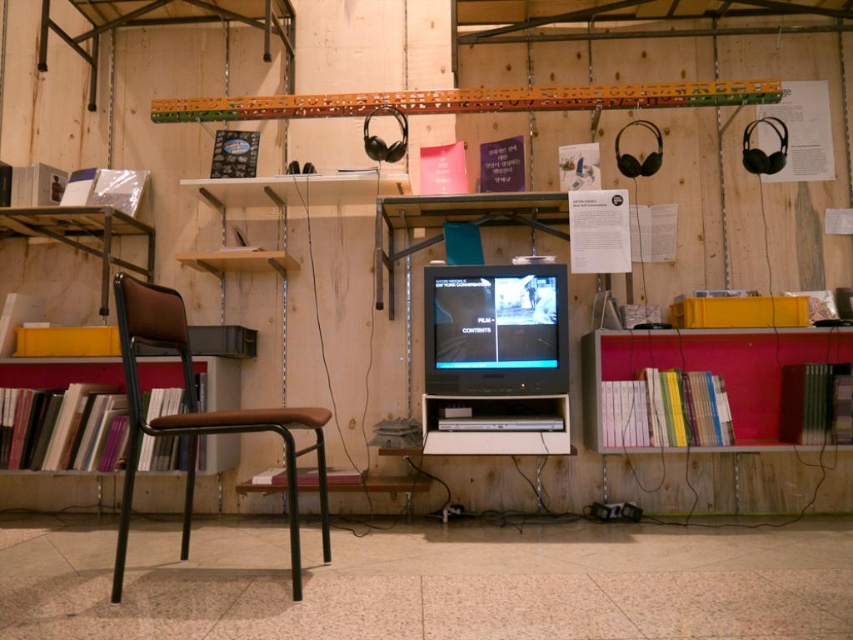
Question: Among these objects, which one is nearest to the camera?

Choices:
 (A) wooden bookshelf at left
 (B) matte black monitor at center
 (C) hardcover books at right

Answer: (C)

Question: Which of the following is the farthest from the observer?

Choices:
 (A) (155, 317)
 (B) (78, 378)

Answer: (B)

Question: Can you confirm if hardcover books at right is positioned to the left of brown leather chair at left?

Choices:
 (A) no
 (B) yes

Answer: (A)

Question: Does hardcover books at right have a larger size compared to brown leather chair at left?

Choices:
 (A) yes
 (B) no

Answer: (B)

Question: Which object appears farthest from the camera in this image?

Choices:
 (A) brown leather chair at left
 (B) hardcover books at right
 (C) wooden bookshelf at left
 (D) matte black monitor at center

Answer: (C)

Question: Is hardcover books at right below wooden bookshelf at left?

Choices:
 (A) no
 (B) yes

Answer: (B)